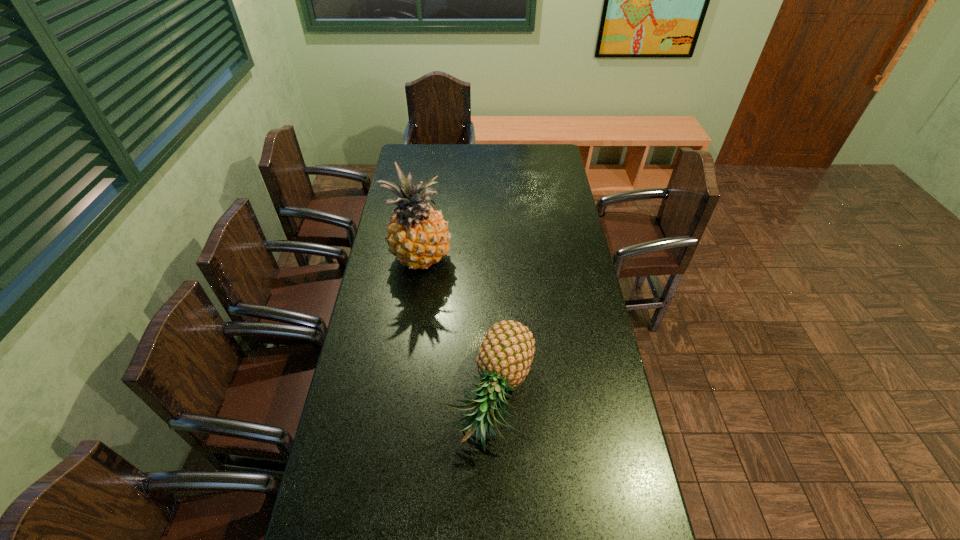
I want to click on vacant area between the left pineapple and the right pineapple, so click(x=457, y=328).

Where is `vacant area that lies between the taller pineapple and the shorter object`? The width and height of the screenshot is (960, 540). vacant area that lies between the taller pineapple and the shorter object is located at coordinates (457, 328).

Find the location of a particular element. This screenshot has height=540, width=960. free space between the taller object and the nearer pineapple is located at coordinates click(x=457, y=328).

Find the location of a particular element. vacant space that is in between the taller object and the right pineapple is located at coordinates tap(457, 328).

You are a GUI agent. You are given a task and a screenshot of the screen. Output one action in this format:
    pyautogui.click(x=<x>, y=<y>)
    Task: Click on the free space between the taller pineapple and the shorter object
    The image size is (960, 540).
    Given the screenshot: What is the action you would take?
    pyautogui.click(x=457, y=328)

You are a GUI agent. You are given a task and a screenshot of the screen. Output one action in this format:
    pyautogui.click(x=<x>, y=<y>)
    Task: Click on the free space between the shorter pineapple and the farther pineapple
    This screenshot has width=960, height=540.
    Given the screenshot: What is the action you would take?
    pyautogui.click(x=457, y=328)

The width and height of the screenshot is (960, 540). Identify the location of free space that satisfies the following two spatial constraints: 1. on the front side of the shorter pineapple; 2. on the left side of the left pineapple. (403, 397).